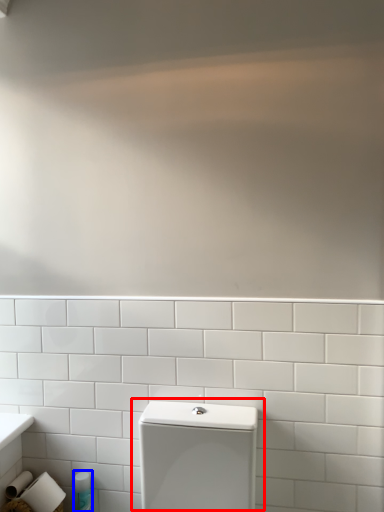
Question: Which object appears closest to the camera in this image, toilet (highlighted by a red box) or toiletry (highlighted by a blue box)?

Choices:
 (A) toilet
 (B) toiletry

Answer: (A)